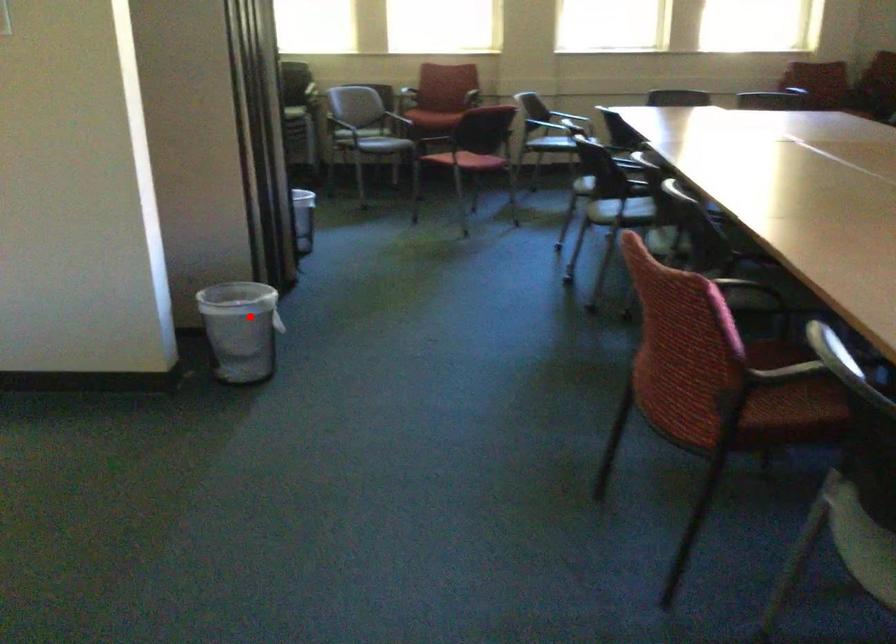
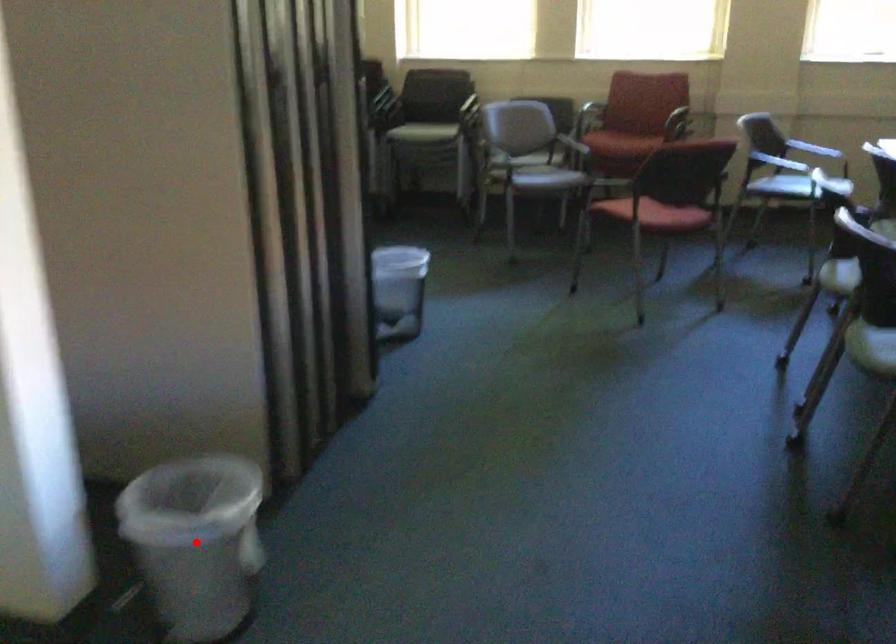
I am providing you with two images of the same scene from different viewpoints. A red point is marked on the first image and another point is marked on the second image. Do the highlighted points in image1 and image2 indicate the same real-world spot?

Yes